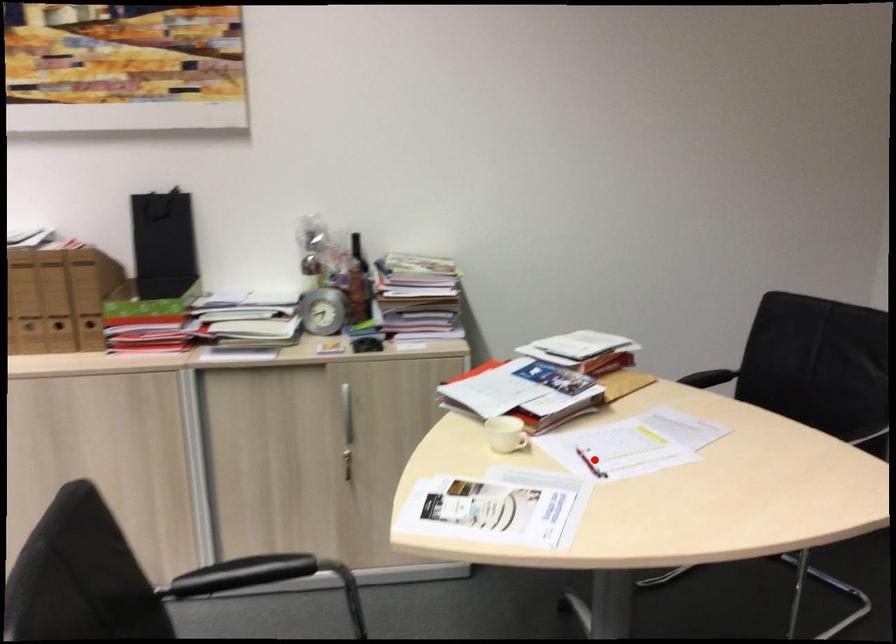
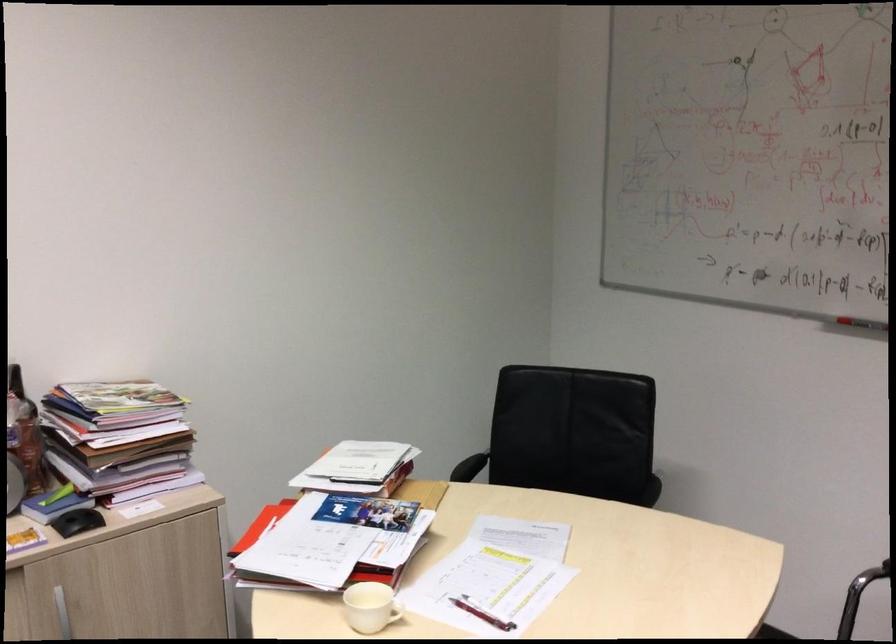
Question: I am providing you with two images of the same scene from different viewpoints. In image1, a red point is highlighted. Considering the same 3D point in image2, which of the following is correct?

Choices:
 (A) It is closer
 (B) It is farther

Answer: (A)